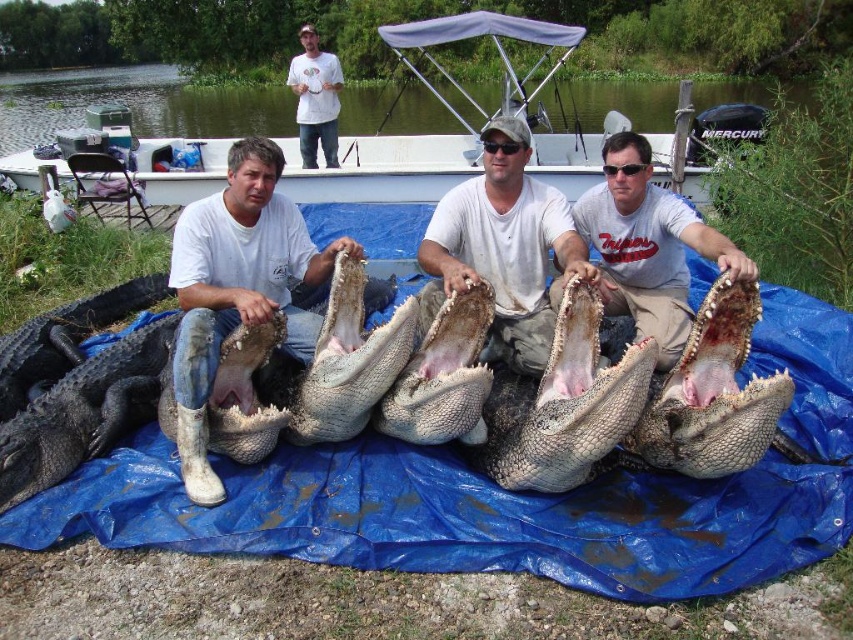
Question: Among these points, which one is nearest to the camera?

Choices:
 (A) (335, 140)
 (B) (263, 273)

Answer: (B)

Question: Which object is the closest to the gray matte shirt at center?

Choices:
 (A) white plastic boat at center
 (B) dark gray scaly crocodile at center

Answer: (B)

Question: Estimate the real-world distances between objects in this image. Which object is farther from the gray matte shirt at center?

Choices:
 (A) dark gray scaly crocodile at center
 (B) white plastic boat at center

Answer: (B)

Question: Observing the image, what is the correct spatial positioning of white plastic boat at center in reference to white matte shirt at center?

Choices:
 (A) below
 (B) above

Answer: (B)

Question: Observing the image, what is the correct spatial positioning of white matte boots at lower left in reference to white matte shirt at center?

Choices:
 (A) left
 (B) right

Answer: (A)

Question: Does white plastic boat at center have a smaller size compared to white t-shirt at upper center?

Choices:
 (A) yes
 (B) no

Answer: (B)